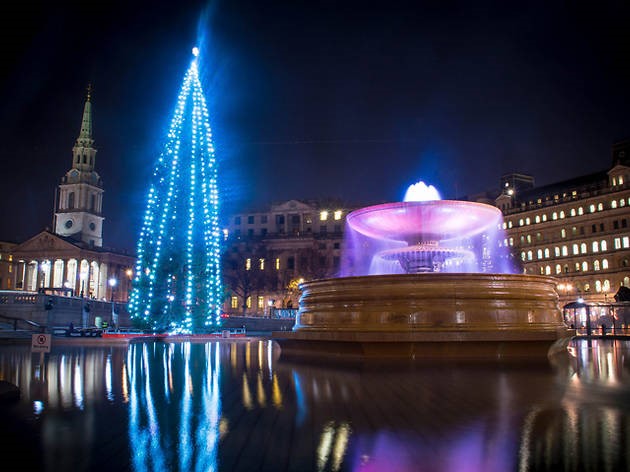
You are a GUI agent. You are given a task and a screenshot of the screen. Output one action in this format:
    pyautogui.click(x=<x>, y=<y>)
    Task: Click on the light
    This screenshot has height=472, width=630.
    Given the screenshot: What is the action you would take?
    pyautogui.click(x=109, y=282), pyautogui.click(x=127, y=273)